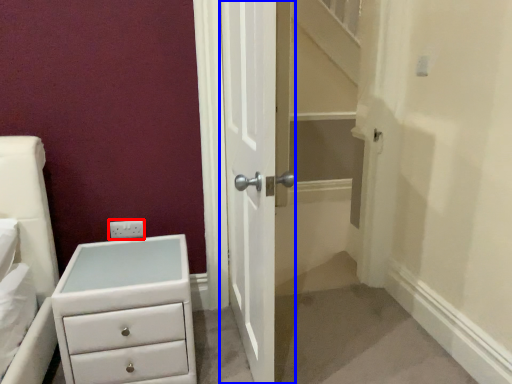
Question: Which object is further to the camera taking this photo, electric outlet (highlighted by a red box) or door (highlighted by a blue box)?

Choices:
 (A) electric outlet
 (B) door

Answer: (A)